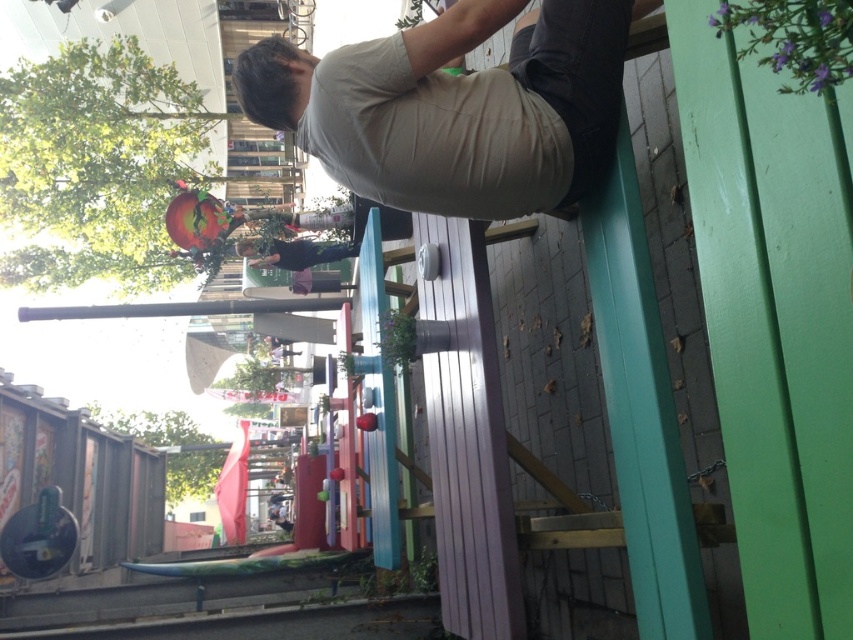
You are standing in the rotated image and want to locate the beige cotton shirt at upper center. According to the scene description, where would you expect to find it in terms of direction and position relative to the table?

The beige cotton shirt at upper center is located at the coordinates point [456,108] in the image, which places it near the upper part of the scene relative to the table.

You are standing at the point marked by the coordinates point [525,150]. You want to grab a drink from the table where the person is sitting. Can you reach it without moving from your current position?

The distance between you and the table where the person is sitting is 1.40 meters. Since this distance is quite far, you likely cannot reach the table without moving closer.